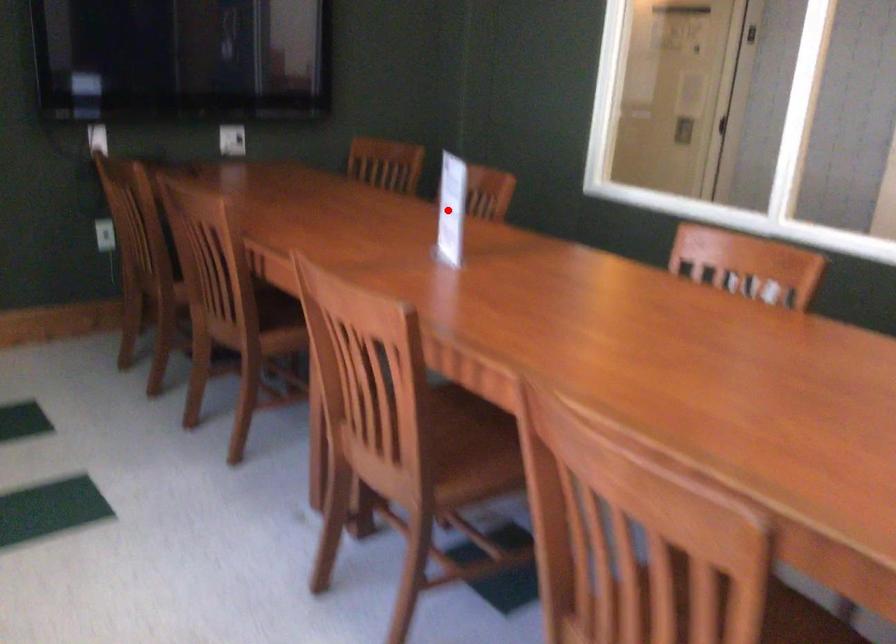
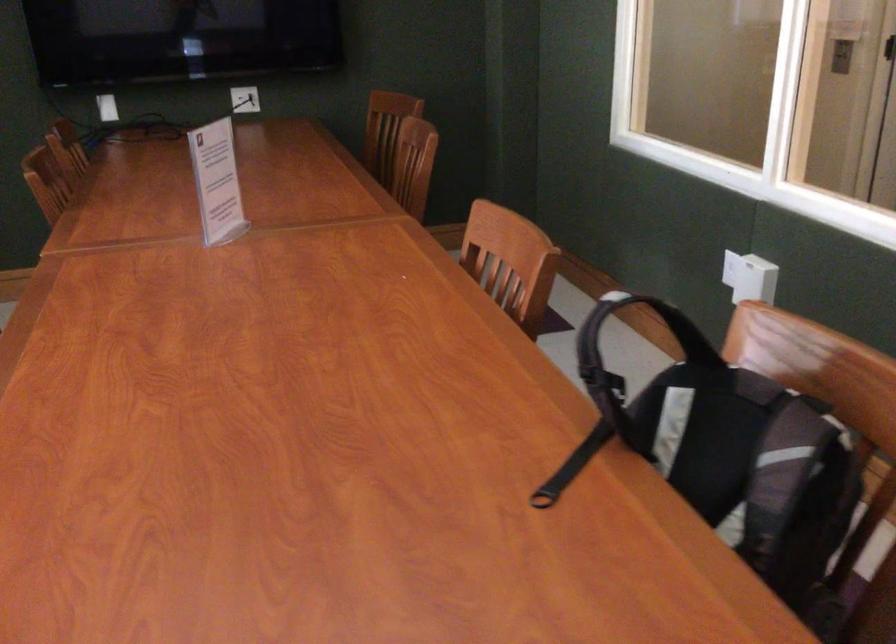
The point at the highlighted location is marked in the first image. Where is the corresponding point in the second image?

(217, 182)